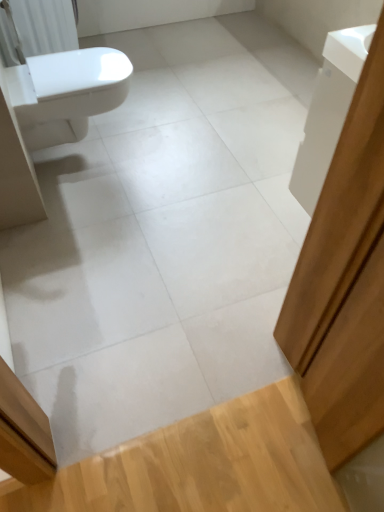
Question: Is white glossy cabinet at upper right smaller than light wood floor at lower right?

Choices:
 (A) yes
 (B) no

Answer: (A)

Question: Is white glossy cabinet at upper right completely or partially outside of light wood floor at lower right?

Choices:
 (A) yes
 (B) no

Answer: (A)

Question: Is white glossy cabinet at upper right in front of light wood floor at lower right?

Choices:
 (A) yes
 (B) no

Answer: (B)

Question: Is white glossy cabinet at upper right not near light wood floor at lower right?

Choices:
 (A) no
 (B) yes

Answer: (A)

Question: Is white glossy cabinet at upper right bigger than light wood floor at lower right?

Choices:
 (A) no
 (B) yes

Answer: (A)

Question: Does white glossy cabinet at upper right appear on the left side of light wood floor at lower right?

Choices:
 (A) yes
 (B) no

Answer: (B)

Question: Considering the relative sizes of white glossy cabinet at upper right and white glossy bidet at left in the image provided, is white glossy cabinet at upper right wider than white glossy bidet at left?

Choices:
 (A) yes
 (B) no

Answer: (B)

Question: Is white glossy cabinet at upper right taller than white glossy bidet at left?

Choices:
 (A) yes
 (B) no

Answer: (A)

Question: Is white glossy cabinet at upper right shorter than white glossy bidet at left?

Choices:
 (A) no
 (B) yes

Answer: (A)

Question: Is white glossy cabinet at upper right aimed at white glossy bidet at left?

Choices:
 (A) no
 (B) yes

Answer: (A)

Question: Can you confirm if white glossy cabinet at upper right is bigger than white glossy bidet at left?

Choices:
 (A) yes
 (B) no

Answer: (B)

Question: Is white glossy cabinet at upper right positioned with its back to white glossy bidet at left?

Choices:
 (A) yes
 (B) no

Answer: (B)

Question: Is white glossy bidet at left a part of white plastic radiator at upper left?

Choices:
 (A) yes
 (B) no

Answer: (B)